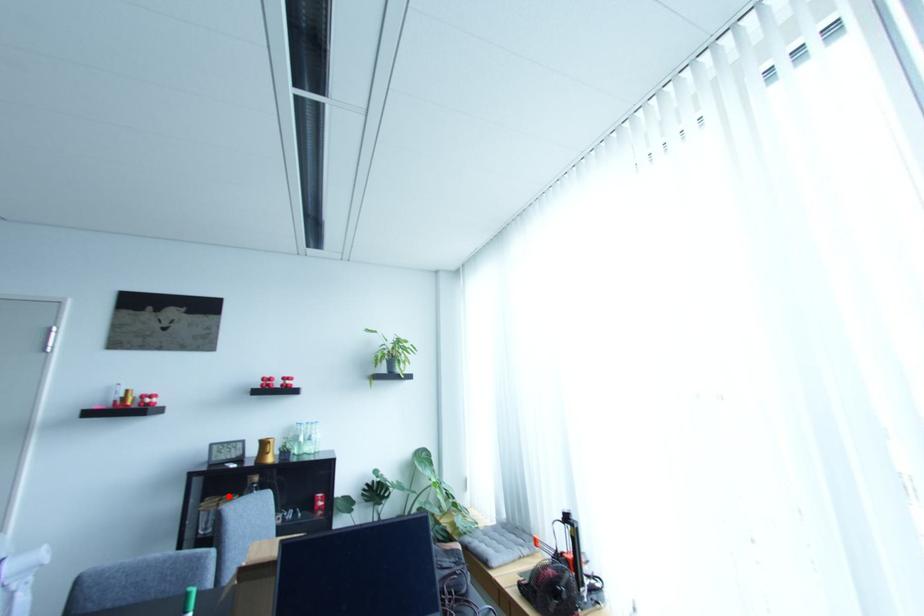
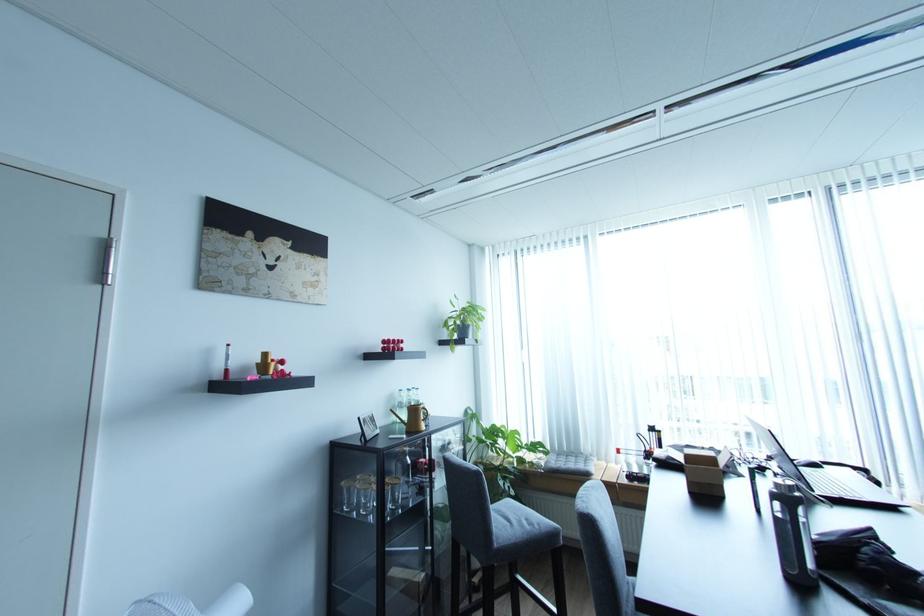
Question: I am providing you with two images of the same scene from different viewpoints. A red point is shown in image1. For the corresponding object point in image2, is it positioned nearer or farther from the camera?

Choices:
 (A) Nearer
 (B) Farther

Answer: (B)